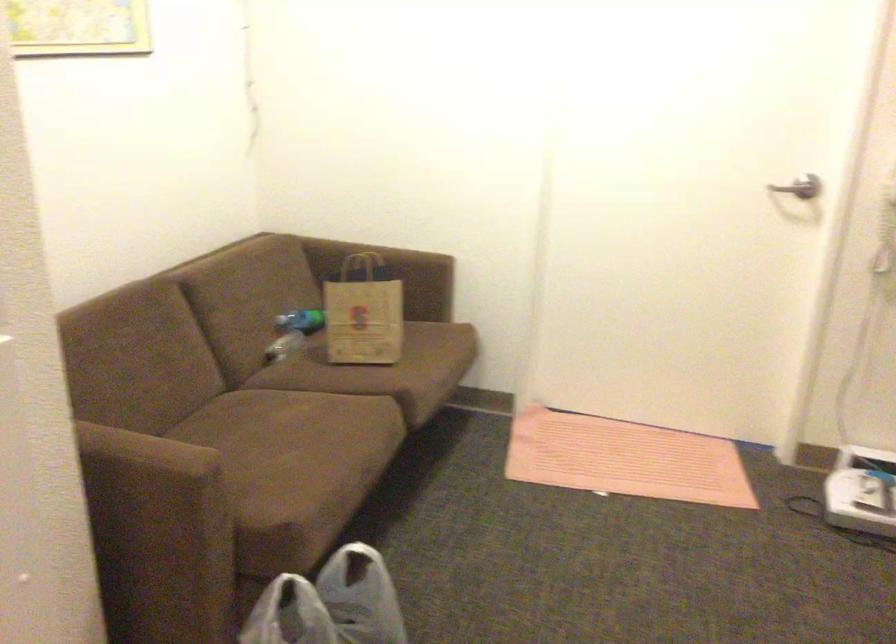
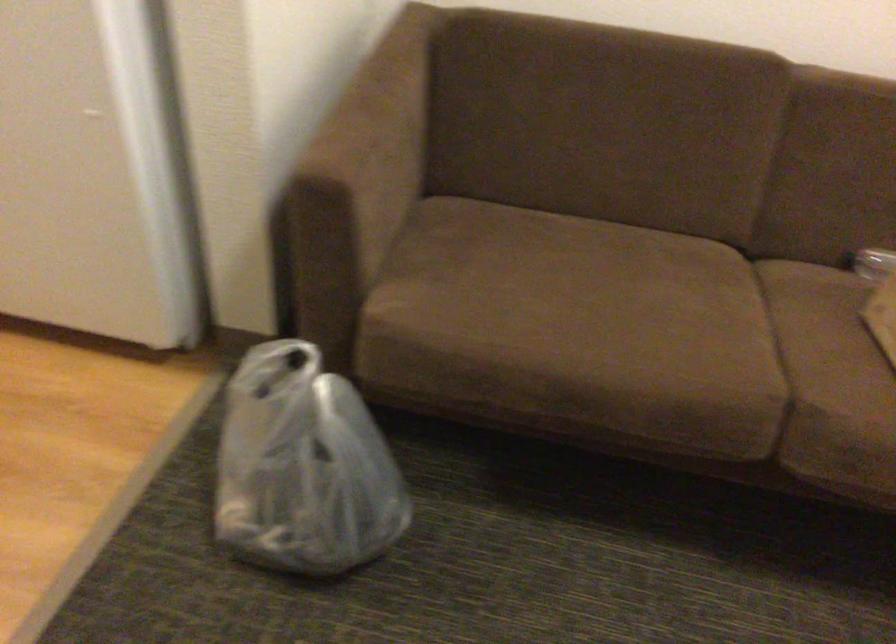
The point at (347, 362) is marked in the first image. Where is the corresponding point in the second image?

(882, 315)